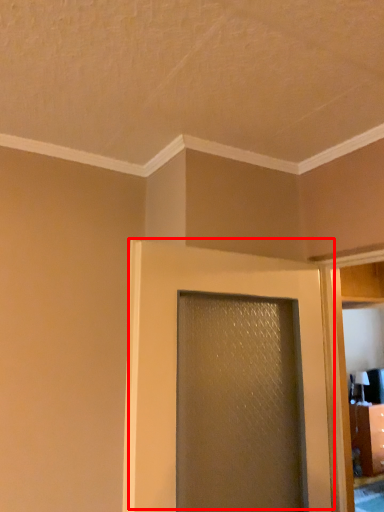
Question: From the image's perspective, where is door (annotated by the red box) located relative to elevator?

Choices:
 (A) below
 (B) above

Answer: (B)